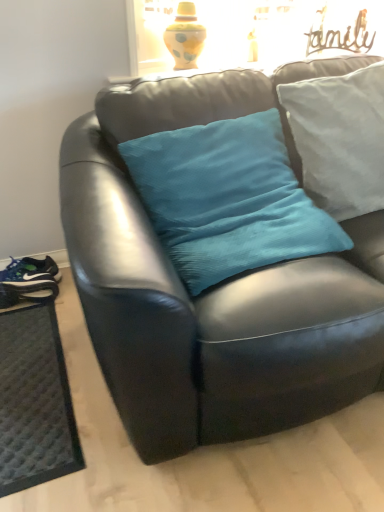
Question: From a real-world perspective, is matte black couch at center above or below dark gray textured mat at lower left?

Choices:
 (A) below
 (B) above

Answer: (B)

Question: From the image's perspective, is matte black couch at center above or below dark gray textured mat at lower left?

Choices:
 (A) above
 (B) below

Answer: (A)

Question: Which of these objects is positioned farthest from the dark gray textured mat at lower left?

Choices:
 (A) teal fabric pillow at center, the 1th pillow from the right
 (B) blue synthetic shoe at lower left
 (C) matte black running shoe at lower left
 (D) teal fabric pillow at center, which appears as the second pillow when viewed from the right
 (E) matte black couch at center

Answer: (A)

Question: Estimate the real-world distances between objects in this image. Which object is farther from the matte black couch at center?

Choices:
 (A) blue synthetic shoe at lower left
 (B) teal fabric pillow at center, which appears as the 2th pillow when viewed from the left
 (C) teal fabric pillow at center, the 1th pillow positioned from the left
 (D) dark gray textured mat at lower left
 (E) matte black running shoe at lower left

Answer: (E)